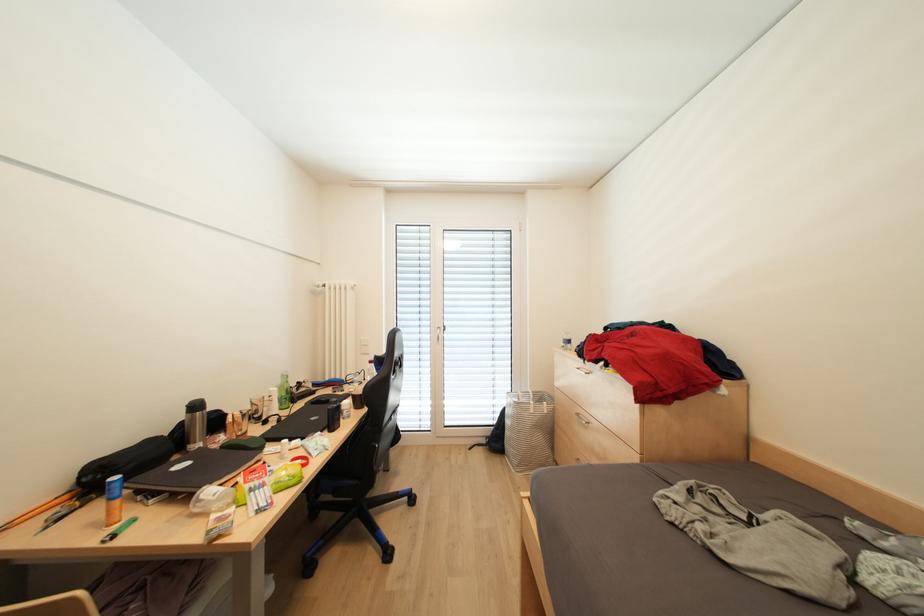
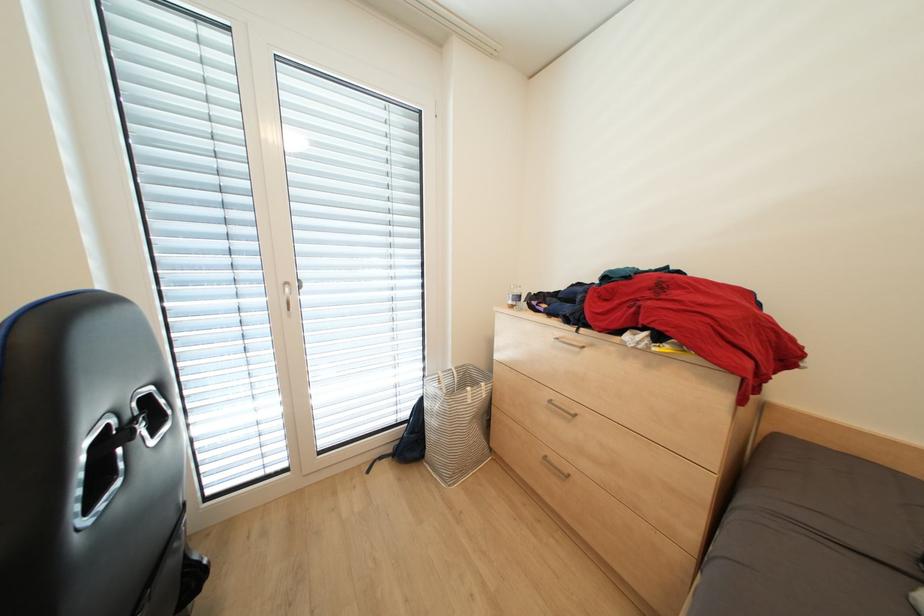
Question: The camera is either moving clockwise (left) or counter-clockwise (right) around the object. The first image is from the beginning of the video and the second image is from the end. Is the camera moving left or right when shooting the video?

Choices:
 (A) Left
 (B) Right

Answer: (A)